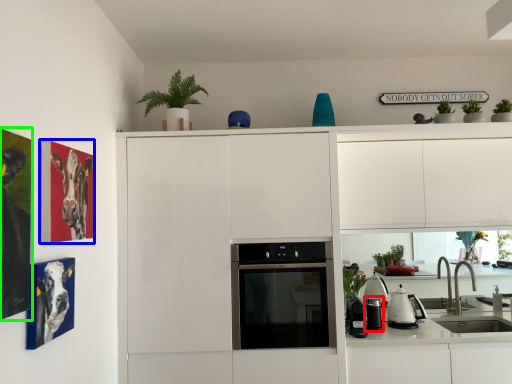
Question: Which object is positioned closest to appliance (highlighted by a red box)? Select from picture frame (highlighted by a blue box) and picture frame (highlighted by a green box).

Choices:
 (A) picture frame
 (B) picture frame

Answer: (A)